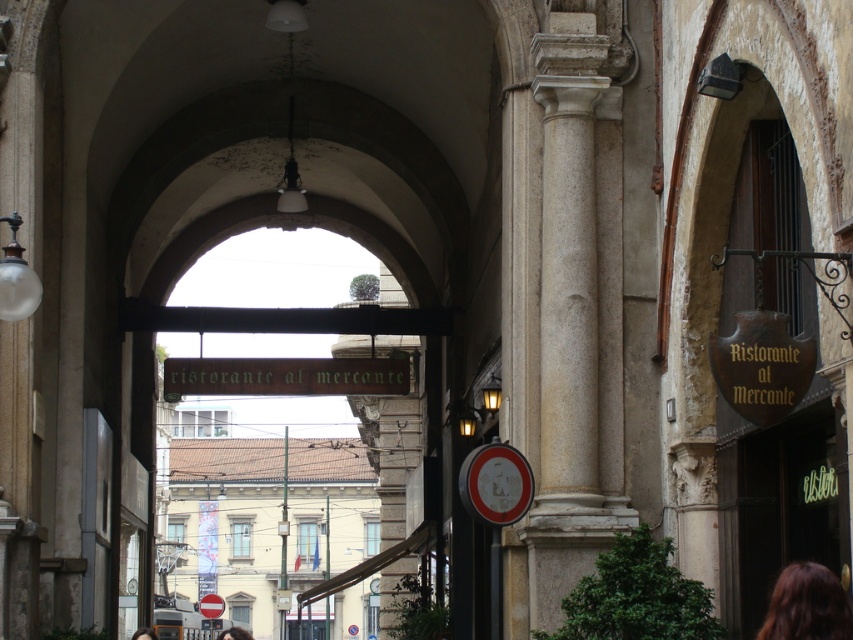
You are standing at the entrance of the arched passageway and see two points marked in the scene. Which point is closer to you, point (593, 161) or point (807, 483)?

Point (593, 161) is closer to you because it is further to the viewer than point (807, 483).

You are a delivery person trying to locate the entrance to Ristorante al Mercante. You see a brown hair at lower right and a red plastic circle at center. Which object is closer to the entrance of the restaurant?

The brown hair at lower right is closer to the entrance of the restaurant because it is positioned over the red plastic circle at center, indicating it is in front.